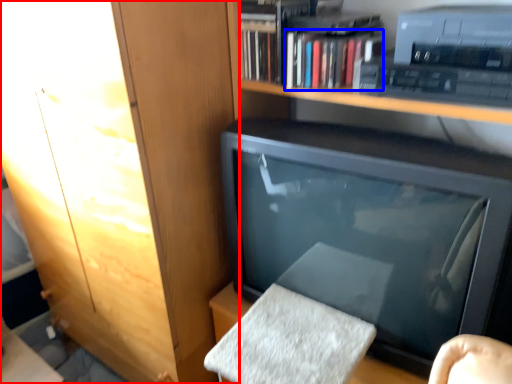
Question: Which point is further to the camera, cabinetry (highlighted by a red box) or book (highlighted by a blue box)?

Choices:
 (A) cabinetry
 (B) book

Answer: (B)